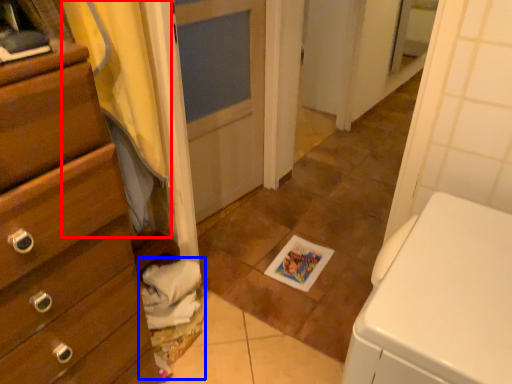
Question: Which object is further to the camera taking this photo, curtain (highlighted by a red box) or laundry (highlighted by a blue box)?

Choices:
 (A) curtain
 (B) laundry

Answer: (B)